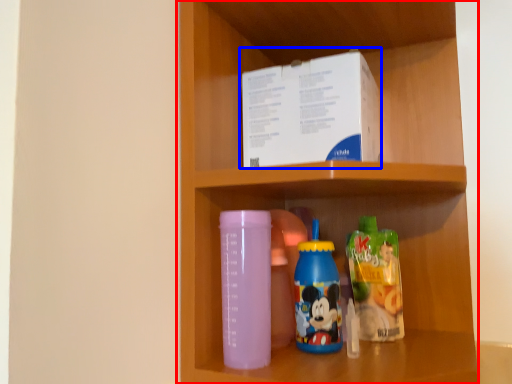
Question: Which object is further to the camera taking this photo, shelf (highlighted by a red box) or box (highlighted by a blue box)?

Choices:
 (A) shelf
 (B) box

Answer: (B)